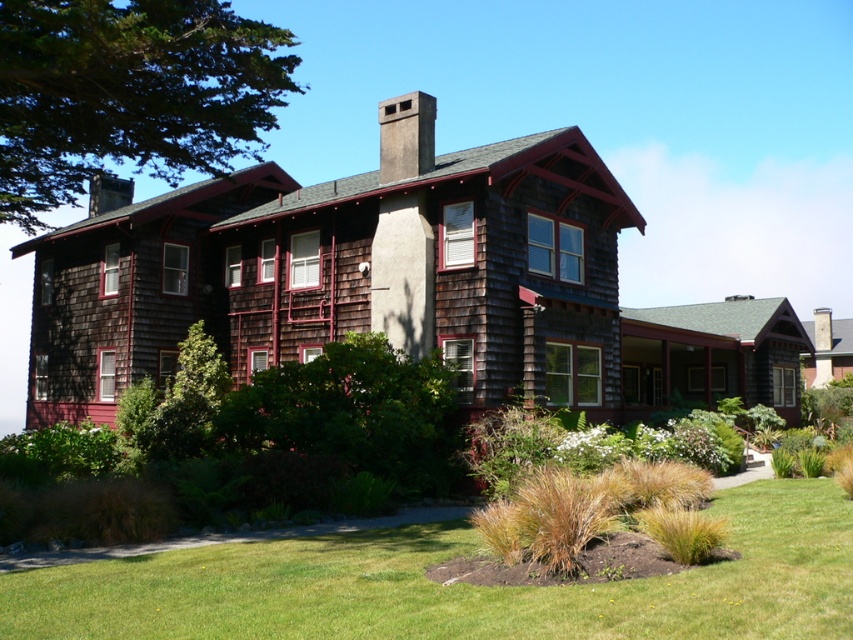
Based on the scene of the two story house with a green leafy tree at upper left and a smooth gray chimney at upper center, which object is wider?

The green leafy tree at upper left might be wider than smooth gray chimney at upper center.

Based on the photo, you are standing in front of the house and notice the green grass at lower center and the green leafy tree at upper left. Which of these two elements takes up more visual space in the image?

The green leafy tree at upper left takes up more visual space than the green grass at lower center.

You are an architect analyzing the exterior of the house. Based on the coordinates provided, where exactly is the brown shingles at upper center positioned on the house?

The brown shingles at upper center are located at point coordinates of 0.212 on the x axis and 0.477 on the y axis.